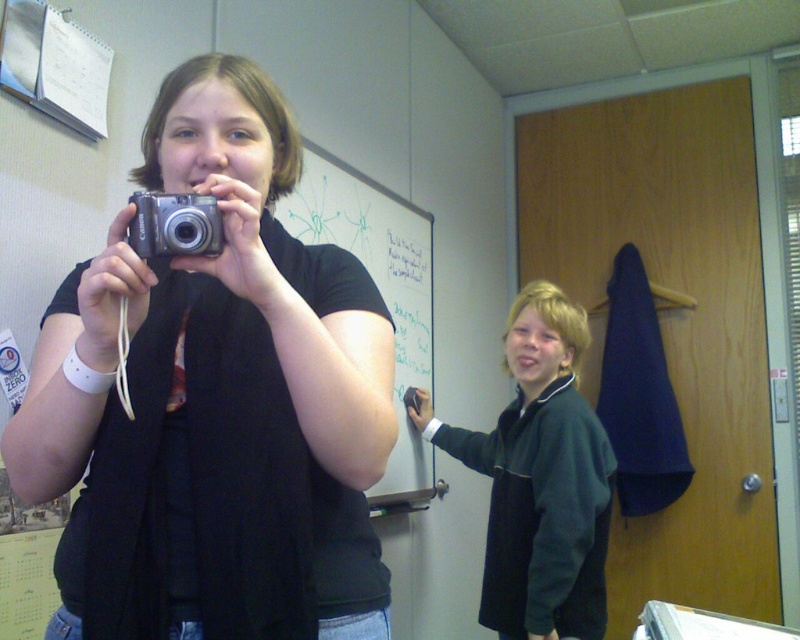
Between dark green fleece at center and silver metallic camera at center, which one is positioned lower?

dark green fleece at center

Consider the image. Can you confirm if dark green fleece at center is positioned above silver metallic camera at center?

Incorrect, dark green fleece at center is not positioned above silver metallic camera at center.

Who is more forward, (554, 513) or (150, 250)?

Point (150, 250) is in front.

Find the location of `dark green fleece at center`. dark green fleece at center is located at coordinates (540, 477).

Is the position of matte black camera at center less distant than that of dark green fleece at center?

Yes, it is in front of dark green fleece at center.

Is point (348, 413) in front of point (520, 324)?

Yes, point (348, 413) is closer to viewer.

Locate an element on the screen. The image size is (800, 640). matte black camera at center is located at coordinates [x=214, y=403].

Who is positioned more to the right, whiteboard at upper center or silver metallic camera at center?

From the viewer's perspective, whiteboard at upper center appears more on the right side.

Is whiteboard at upper center positioned behind silver metallic camera at center?

Yes, it is behind silver metallic camera at center.

The width and height of the screenshot is (800, 640). What do you see at coordinates (380, 292) in the screenshot?
I see `whiteboard at upper center` at bounding box center [380, 292].

Where is `whiteboard at upper center`? whiteboard at upper center is located at coordinates (380, 292).